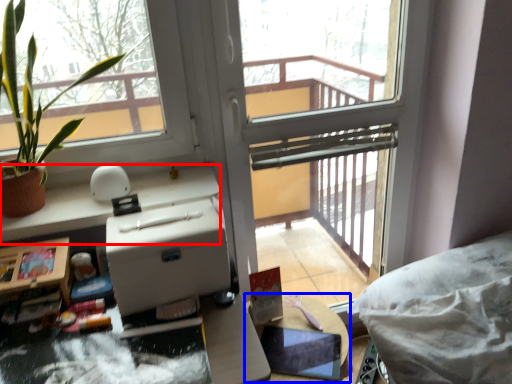
Question: Which point is closer to the camera, counter top (highlighted by a red box) or table (highlighted by a blue box)?

Choices:
 (A) counter top
 (B) table

Answer: (A)